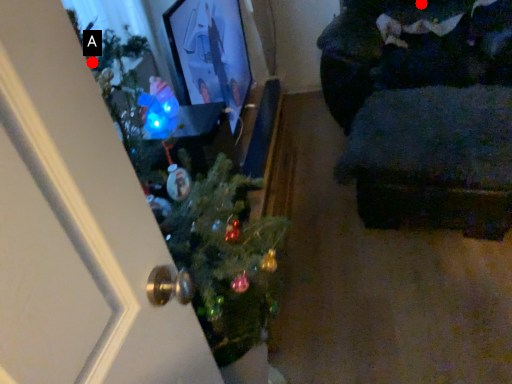
Question: Two points are circled on the image, labeled by A and B beside each circle. Which point appears farthest from the camera in this image?

Choices:
 (A) A is further
 (B) B is further

Answer: (B)